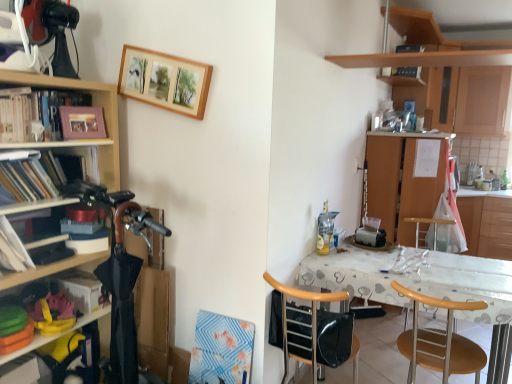
Question: Is matte wooden picture frame at upper left, which appears as the first picture frame when ordered from the bottom, to the left or to the right of wooden cabinet at right, acting as the third cabinetry starting from the left, in the image?

Choices:
 (A) left
 (B) right

Answer: (A)

Question: From a real-world perspective, relative to wooden cabinet at right, acting as the third cabinetry starting from the left, is matte wooden picture frame at upper left, which appears as the 2th picture frame when viewed from the right, vertically above or below?

Choices:
 (A) below
 (B) above

Answer: (B)

Question: Which of these objects is positioned closest to the wooden bookshelf at left?

Choices:
 (A) wooden picture frame at upper center, the 2th picture frame positioned from the left
 (B) wooden cabinet at right, the 1th cabinetry from the right
 (C) rubber yellow shoes at lower left, the third shelf from the top
 (D) white paper at left, the first book viewed from the front
 (E) wooden cabinet at upper right, the 2th cabinetry in the right-to-left sequence

Answer: (A)

Question: Considering the real-world distances, which object is farthest from the wooden at right, the second chair when ordered from left to right?

Choices:
 (A) wooden bar stool at center
 (B) rubber yellow shoes at lower left, positioned as the 1th shelf in bottom-to-top order
 (C) black leather chair at center, the 1th chair from the left
 (D) matte black book at left, the second book when ordered from front to back
 (E) matte wooden picture frame at upper left, which appears as the first picture frame when ordered from the bottom

Answer: (E)